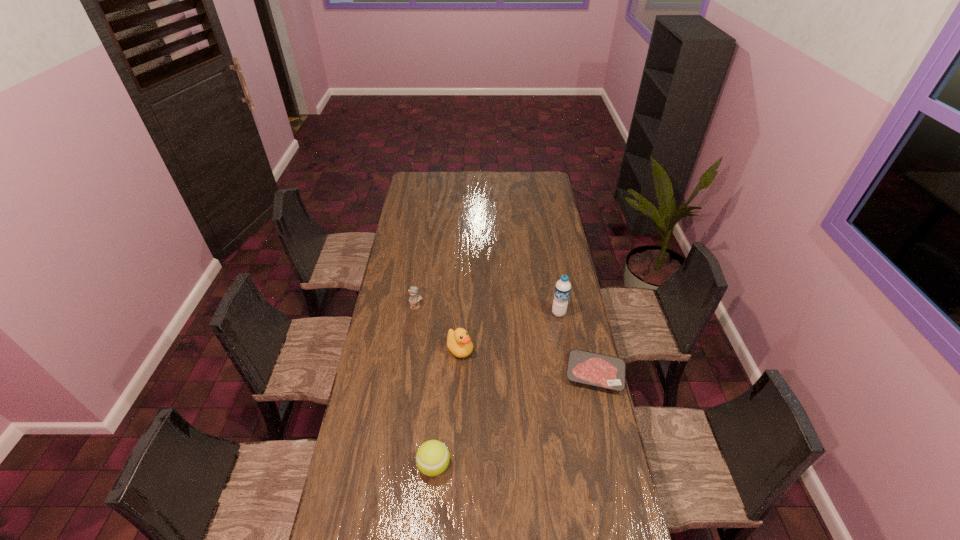
Find the location of a particular element. The width and height of the screenshot is (960, 540). free space between the tennis ball and the duck is located at coordinates (447, 408).

Locate an element on the screen. The image size is (960, 540). empty space between the shortest object and the tennis ball is located at coordinates (515, 420).

Where is `object that is the second closest to the fourth shortest object`? This screenshot has height=540, width=960. object that is the second closest to the fourth shortest object is located at coordinates (584, 367).

Identify which object is the third nearest to the nearest object. Please provide its 2D coordinates. Your answer should be formatted as a tuple, i.e. [(x, y)], where the tuple contains the x and y coordinates of a point satisfying the conditions above.

[(414, 298)]

Locate an element on the screen. vacant space that satisfies the following two spatial constraints: 1. on the front side of the tallest object; 2. on the right side of the shortest object is located at coordinates (569, 374).

I want to click on vacant region that satisfies the following two spatial constraints: 1. on the front side of the tennis ball; 2. on the left side of the leftmost object, so click(x=394, y=465).

Image resolution: width=960 pixels, height=540 pixels. Identify the location of free space that satisfies the following two spatial constraints: 1. on the front side of the second tallest object; 2. on the right side of the shortest object. (459, 374).

The image size is (960, 540). What are the coordinates of `blank space that satisfies the following two spatial constraints: 1. on the front side of the nearest object; 2. on the right side of the teddy bear` in the screenshot? It's located at [x=394, y=465].

Identify the location of free spot that satisfies the following two spatial constraints: 1. on the back side of the shortest object; 2. on the left side of the tennis ball. (441, 374).

This screenshot has width=960, height=540. I want to click on vacant space that satisfies the following two spatial constraints: 1. on the back side of the tennis ball; 2. on the right side of the steak, so click(x=441, y=374).